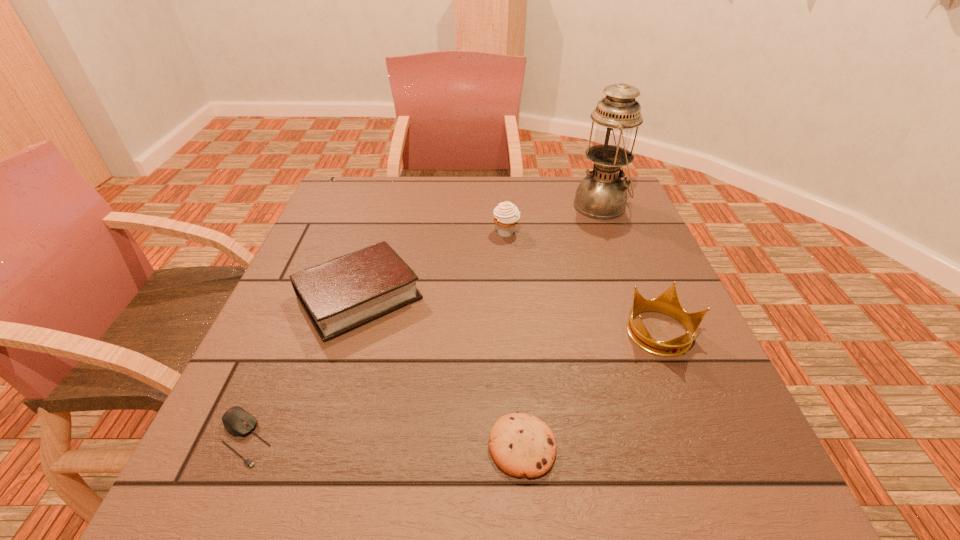
Locate an element on the screen. vacant space located 0.290m on the left of the crown is located at coordinates (486, 334).

Find the location of `vacant space situated on the front of the third shortest object`. vacant space situated on the front of the third shortest object is located at coordinates (295, 510).

Where is `free space located on the left of the cookie`? The image size is (960, 540). free space located on the left of the cookie is located at coordinates (452, 446).

The width and height of the screenshot is (960, 540). In order to click on free region located 0.310m on the right of the mouse in this screenshot , I will do `click(460, 438)`.

Identify the location of object that is at the far edge. Image resolution: width=960 pixels, height=540 pixels. tap(602, 195).

Image resolution: width=960 pixels, height=540 pixels. In order to click on cookie positioned at the near edge in this screenshot , I will do `click(521, 445)`.

The height and width of the screenshot is (540, 960). What are the coordinates of `mouse present at the near edge` in the screenshot? It's located at (238, 422).

Identify the location of Bible that is at the left edge. This screenshot has height=540, width=960. (338, 295).

I want to click on mouse situated at the left edge, so click(238, 422).

At what (x,y) coordinates should I click in order to perform the action: click on oil lamp at the right edge. Please return your answer as a coordinate pair (x, y). Looking at the image, I should click on (602, 195).